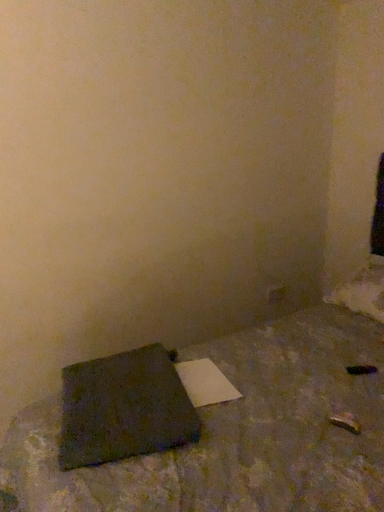
Identify the location of free space above dark gray fabric notebook at lower left (from a real-world perspective). This screenshot has height=512, width=384. (145, 380).